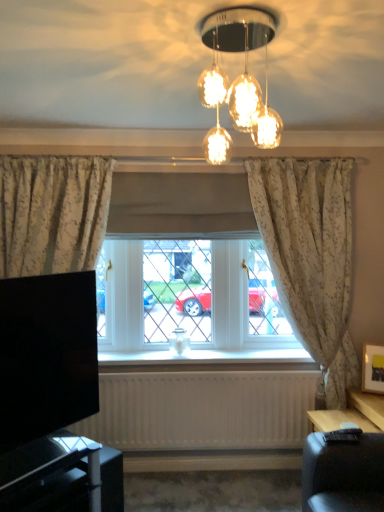
Question: In the image, is white wood window sill at center positioned in front of or behind translucent glass light fixture at upper center?

Choices:
 (A) behind
 (B) front

Answer: (A)

Question: Based on their positions, is white wood window sill at center located to the left or right of translucent glass light fixture at upper center?

Choices:
 (A) right
 (B) left

Answer: (B)

Question: Estimate the real-world distances between objects in this image. Which object is farther from the white wood window sill at center?

Choices:
 (A) floral fabric curtain at right
 (B) white textured radiator at lower center
 (C) wooden framed picture at right
 (D) black glossy tv at lower left
 (E) black glossy tv stand at lower left

Answer: (E)

Question: Which object is the closest to the white wood window sill at center?

Choices:
 (A) wooden framed picture at right
 (B) black glossy tv at lower left
 (C) floral fabric curtain at right
 (D) translucent glass light fixture at upper center
 (E) black glossy tv stand at lower left

Answer: (C)